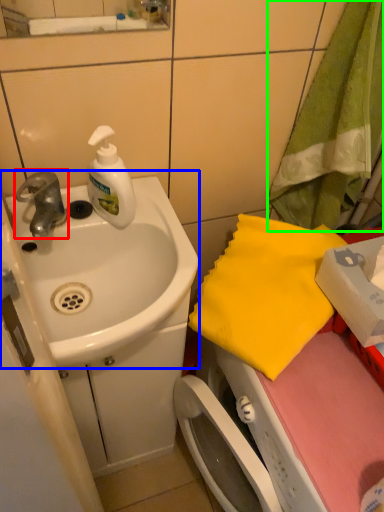
Question: Considering the real-world distances, which object is closest to tap (highlighted by a red box)? sink (highlighted by a blue box) or beach towel (highlighted by a green box).

Choices:
 (A) sink
 (B) beach towel

Answer: (A)